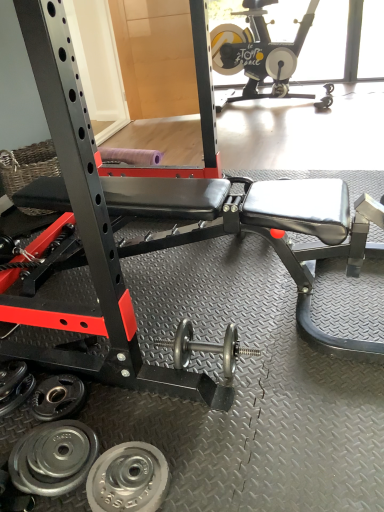
Question: Is black matte stationary bike at upper right positioned with its back to silver metallic weight plate at lower left, the third wheel positioned from the back?

Choices:
 (A) yes
 (B) no

Answer: (B)

Question: Is black matte stationary bike at upper right at the right side of silver metallic weight plate at lower left, which ranks as the first wheel in front-to-back order?

Choices:
 (A) yes
 (B) no

Answer: (A)

Question: Is silver metallic weight plate at lower left, the third wheel positioned from the back, located within black matte stationary bike at upper right?

Choices:
 (A) yes
 (B) no

Answer: (B)

Question: Is black matte stationary bike at upper right not within silver metallic weight plate at lower left, the third wheel positioned from the back?

Choices:
 (A) no
 (B) yes

Answer: (B)

Question: Does black matte stationary bike at upper right come in front of silver metallic weight plate at lower left, the third wheel positioned from the back?

Choices:
 (A) no
 (B) yes

Answer: (A)

Question: Is the depth of black matte stationary bike at upper right greater than that of silver metallic weight plate at lower left, which ranks as the first wheel in front-to-back order?

Choices:
 (A) yes
 (B) no

Answer: (A)

Question: Is polished silver dumbbell at center behind silver metallic weight plate at lower left, which ranks as the first wheel in front-to-back order?

Choices:
 (A) yes
 (B) no

Answer: (A)

Question: From the image's perspective, is polished silver dumbbell at center on top of silver metallic weight plate at lower left, the third wheel positioned from the back?

Choices:
 (A) no
 (B) yes

Answer: (B)

Question: Does polished silver dumbbell at center have a lesser height compared to silver metallic weight plate at lower left, which ranks as the first wheel in front-to-back order?

Choices:
 (A) yes
 (B) no

Answer: (B)

Question: Does polished silver dumbbell at center have a larger size compared to silver metallic weight plate at lower left, the third wheel positioned from the back?

Choices:
 (A) yes
 (B) no

Answer: (A)

Question: Is polished silver dumbbell at center oriented away from silver metallic weight plate at lower left, which ranks as the first wheel in front-to-back order?

Choices:
 (A) no
 (B) yes

Answer: (A)

Question: From a real-world perspective, does polished silver dumbbell at center sit lower than silver metallic weight plate at lower left, the third wheel positioned from the back?

Choices:
 (A) no
 (B) yes

Answer: (A)

Question: From the image's perspective, does silver metallic weight plate at lower left, the third wheel positioned from the back, appear higher than polished silver dumbbell at center?

Choices:
 (A) no
 (B) yes

Answer: (A)